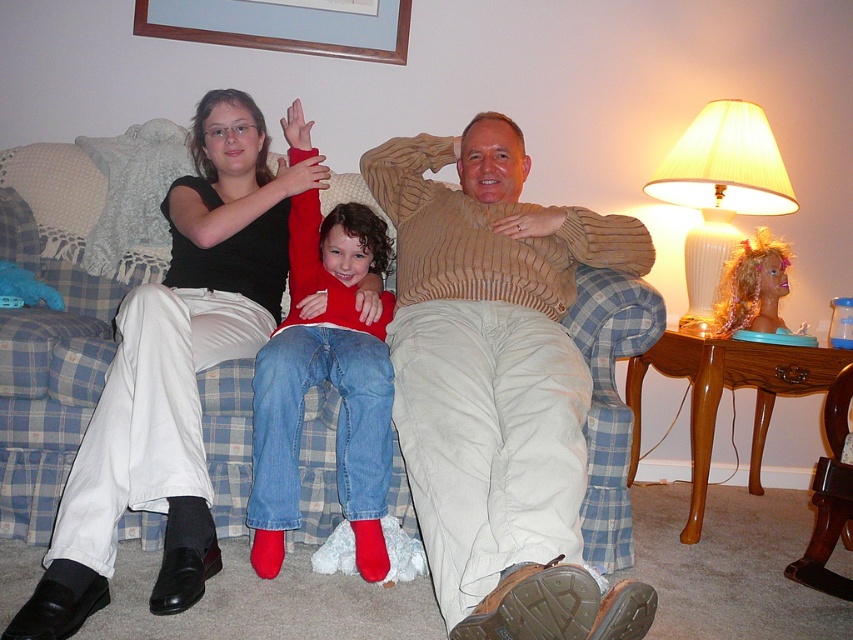
You are standing in the living room and want to place a new photo on the wall directly above the wooden picture frame at upper center. What are the coordinates where you should place the new photo?

The wooden picture frame at upper center is located at coordinates (280, 26). To place the new photo directly above it, you should position it at the same x coordinate, 0.042, and a slightly lower y coordinate, such as 0.320, depending on the desired distance.

You are arranging a family photo in your living room and have a wooden picture frame at upper center and a wooden chair at lower right. Which object is located to the left of the other?

The wooden picture frame at upper center is positioned on the left side of wooden chair at lower right.